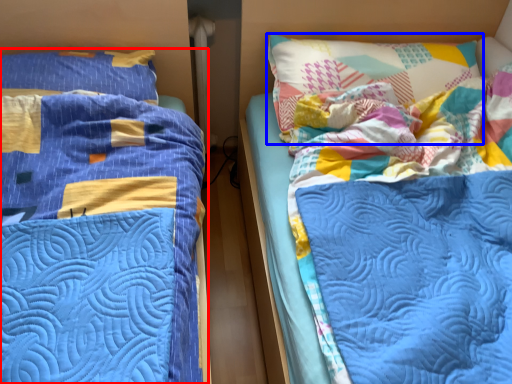
Question: Which of the following is the farthest to the observer, bed (highlighted by a red box) or pillow (highlighted by a blue box)?

Choices:
 (A) bed
 (B) pillow

Answer: (B)